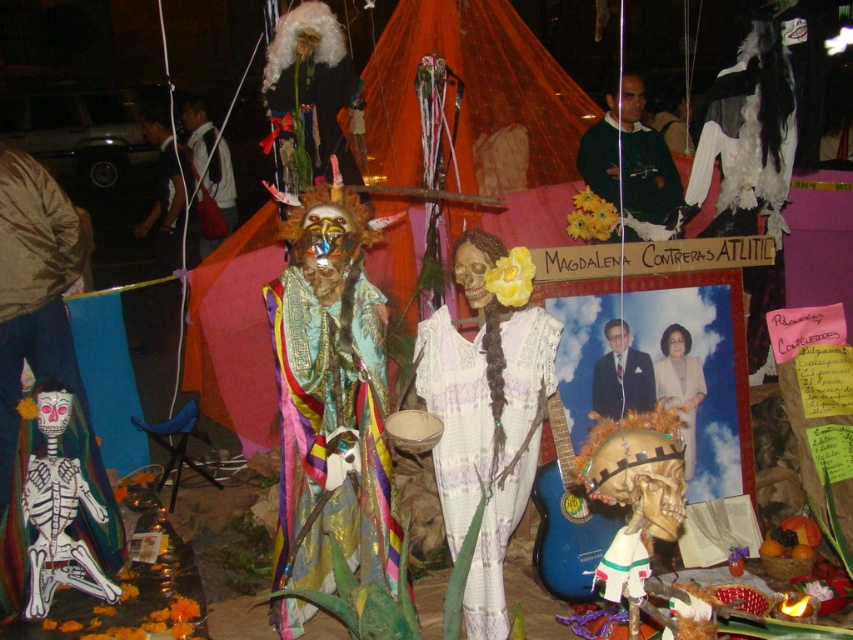
You are a photographer at the event and want to capture both the white lace dress at center and the formal suit at center in a single photo. Which one should you focus on first to ensure it appears sharp in the photo?

You should focus on the white lace dress at center first because it is in front of the formal suit at center, so focusing on the closer object will keep it sharp while the background may blur slightly.

You are organizing a costume party and need to decide which outfit to choose between the white lace dress at center and the formal suit at center. Based on their sizes, which one would you pick if you want a larger outfit?

The white lace dress at center is bigger than the formal suit at center, so you should choose the white lace dress at center for a larger outfit.

You are an event planner setting up a booth at the festival. You need to place a decorative skull at point (310, 97). However, there is already an object there. What object is blocking the placement of the skull?

The white fluffy wig at upper center is located at point (310, 97), so it is blocking the placement of the skull.